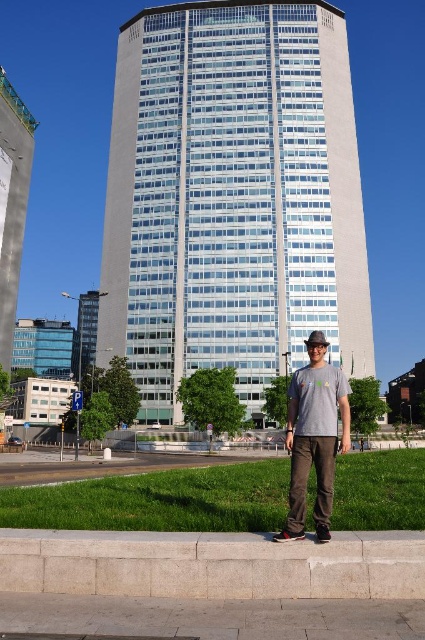
Question: Which object appears closest to the camera in this image?

Choices:
 (A) gray cotton t-shirt at center
 (B) white glass building at left

Answer: (A)

Question: Which object appears farthest from the camera in this image?

Choices:
 (A) gray concrete curb at lower center
 (B) glassy white building at center

Answer: (B)

Question: Is glassy white building at center bigger than white glass building at left?

Choices:
 (A) yes
 (B) no

Answer: (A)

Question: Which object is positioned closest to the glassy white building at center?

Choices:
 (A) gray cotton t-shirt at center
 (B) white glass building at left

Answer: (B)

Question: Does gray concrete curb at lower center appear on the left side of gray cotton t-shirt at center?

Choices:
 (A) no
 (B) yes

Answer: (B)

Question: Does gray concrete curb at lower center have a larger size compared to white glass building at left?

Choices:
 (A) yes
 (B) no

Answer: (B)